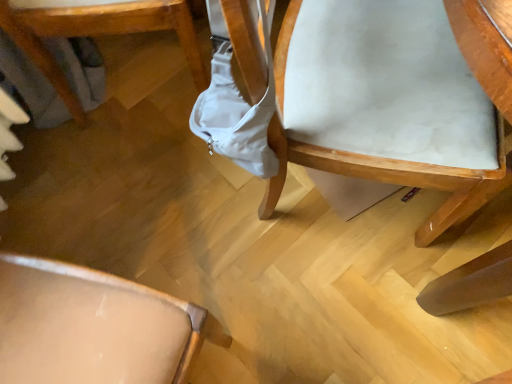
Question: Is light brown wood chair at lower left, which is the 2th chair from right to left, smaller than white fabric chair at upper right, the 1th chair in the right-to-left sequence?

Choices:
 (A) no
 (B) yes

Answer: (B)

Question: Is light brown wood chair at lower left, which is the 2th chair from right to left, positioned far away from white fabric chair at upper right, the 1th chair in the right-to-left sequence?

Choices:
 (A) no
 (B) yes

Answer: (A)

Question: Is white fabric chair at upper right, the 1th chair in the right-to-left sequence, inside light brown wood chair at lower left, which is the 2th chair from right to left?

Choices:
 (A) yes
 (B) no

Answer: (B)

Question: Is light brown wood chair at lower left, which is the 2th chair from right to left, oriented away from white fabric chair at upper right, the 1th chair in the right-to-left sequence?

Choices:
 (A) yes
 (B) no

Answer: (B)

Question: From a real-world perspective, is light brown wood chair at lower left, which is the first chair in left-to-right order, below white fabric chair at upper right, the 1th chair in the right-to-left sequence?

Choices:
 (A) yes
 (B) no

Answer: (A)

Question: Can you confirm if light brown wood chair at lower left, which is the 2th chair from right to left, is shorter than white fabric chair at upper right, the 1th chair in the right-to-left sequence?

Choices:
 (A) yes
 (B) no

Answer: (A)

Question: Does white fabric chair at upper right, the 1th chair in the right-to-left sequence, have a smaller size compared to light brown wood chair at lower left, which is the first chair in left-to-right order?

Choices:
 (A) yes
 (B) no

Answer: (B)

Question: Does white fabric chair at upper right, the 1th chair in the right-to-left sequence, come behind light brown wood chair at lower left, which is the 2th chair from right to left?

Choices:
 (A) no
 (B) yes

Answer: (A)

Question: Considering the relative positions of white fabric chair at upper right, the 1th chair in the right-to-left sequence, and light brown wood chair at lower left, which is the 2th chair from right to left, in the image provided, is white fabric chair at upper right, the 1th chair in the right-to-left sequence, to the right of light brown wood chair at lower left, which is the 2th chair from right to left, from the viewer's perspective?

Choices:
 (A) yes
 (B) no

Answer: (A)

Question: Is white fabric chair at upper right, the 2th chair from the left, at the left side of light brown wood chair at lower left, which is the 2th chair from right to left?

Choices:
 (A) no
 (B) yes

Answer: (A)

Question: From a real-world perspective, is white fabric chair at upper right, the 2th chair from the left, under light brown wood chair at lower left, which is the first chair in left-to-right order?

Choices:
 (A) no
 (B) yes

Answer: (A)

Question: Is white fabric chair at upper right, the 2th chair from the left, positioned before light brown wood chair at lower left, which is the 2th chair from right to left?

Choices:
 (A) no
 (B) yes

Answer: (B)

Question: Looking at the image, does white fabric chair at upper right, the 1th chair in the right-to-left sequence, seem bigger or smaller compared to light brown wood chair at lower left, which is the first chair in left-to-right order?

Choices:
 (A) small
 (B) big

Answer: (B)